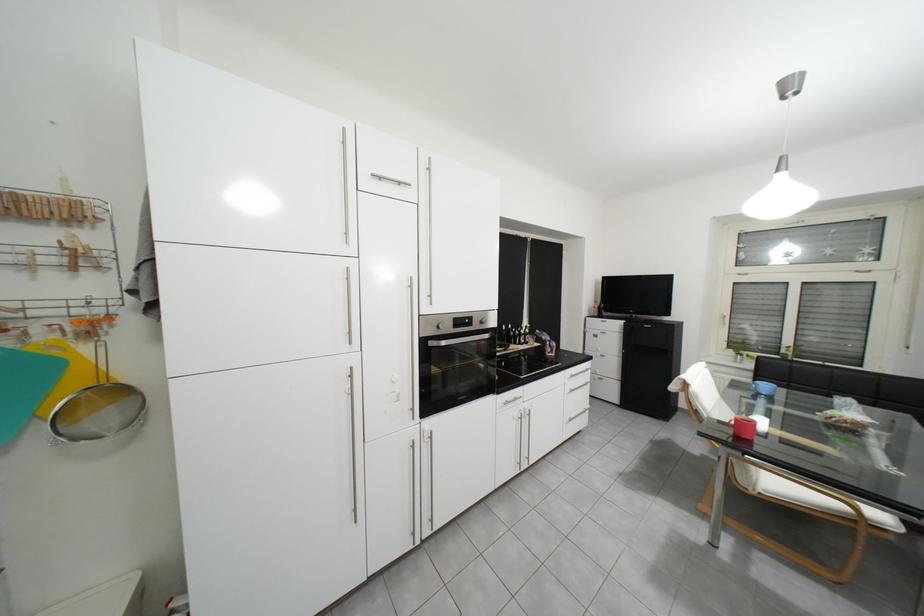
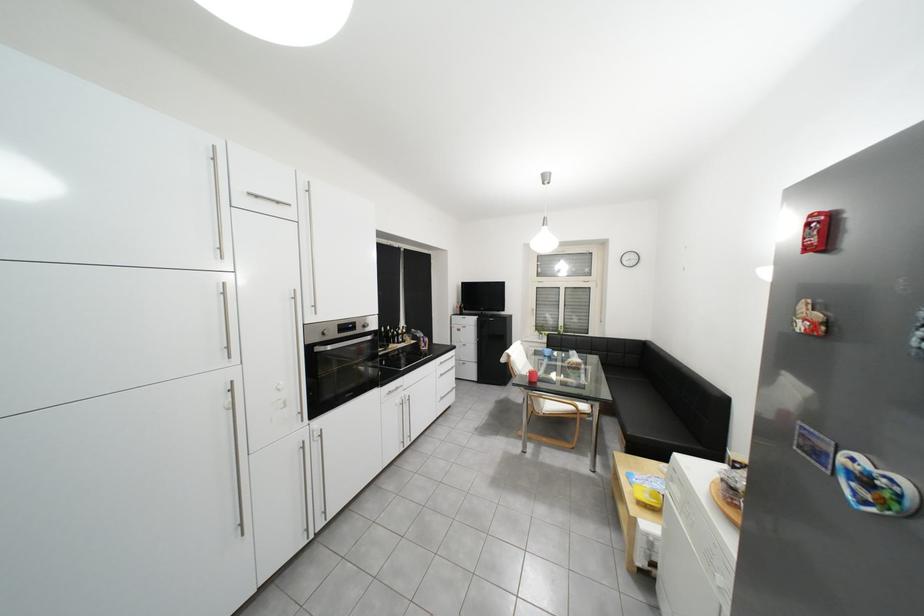
Locate, in the second image, the point that corresponds to the point at 482,320 in the first image.

(366, 325)